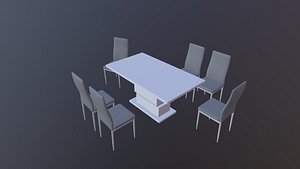
The width and height of the screenshot is (300, 169). Identify the location of chair back. (104, 107).